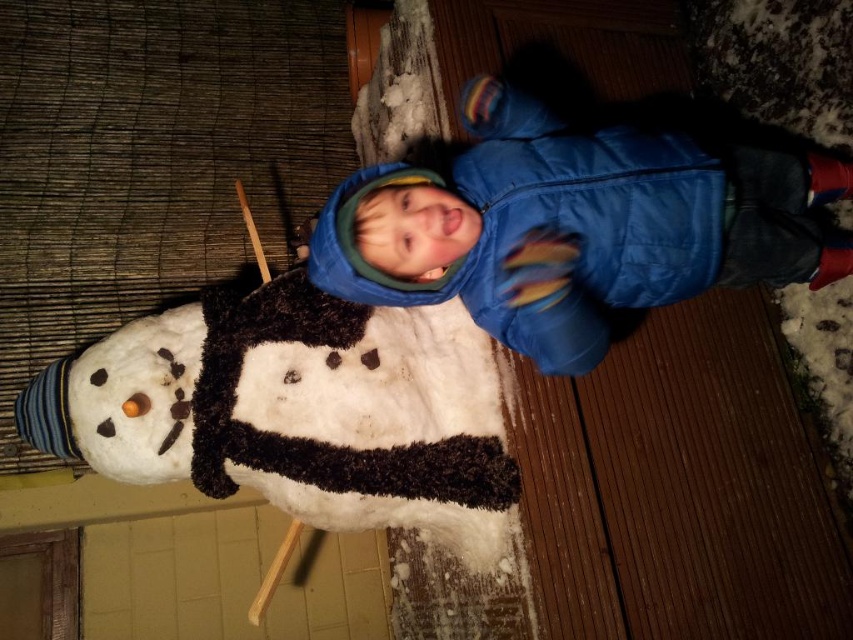
Question: Can you confirm if white fluffy snowman at center is positioned to the right of blue puffy jacket at center?

Choices:
 (A) yes
 (B) no

Answer: (B)

Question: Which of the following is the closest to the observer?

Choices:
 (A) (503, 529)
 (B) (508, 218)

Answer: (B)

Question: Is white fluffy snowman at center to the left of blue puffy jacket at center from the viewer's perspective?

Choices:
 (A) yes
 (B) no

Answer: (A)

Question: Is white fluffy snowman at center below blue puffy jacket at center?

Choices:
 (A) no
 (B) yes

Answer: (B)